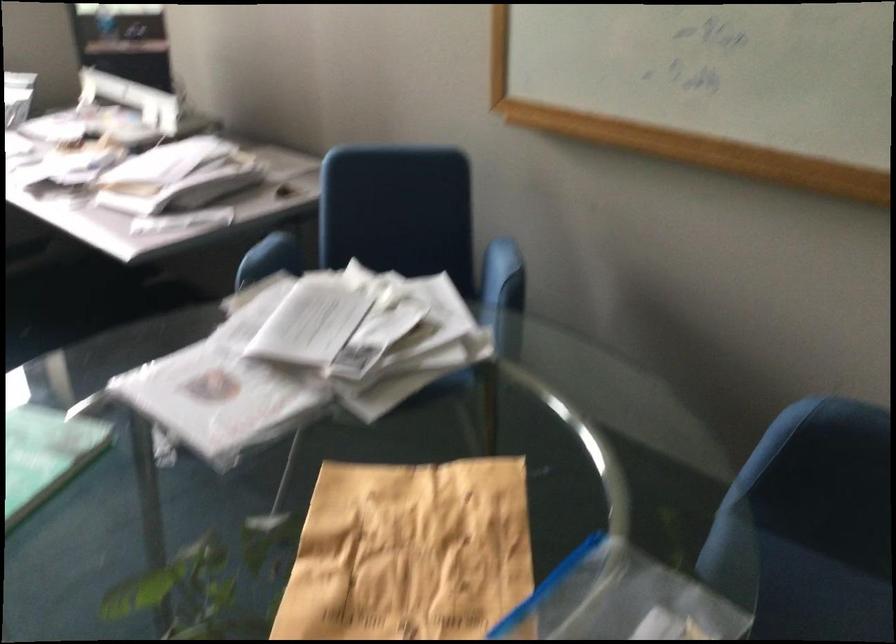
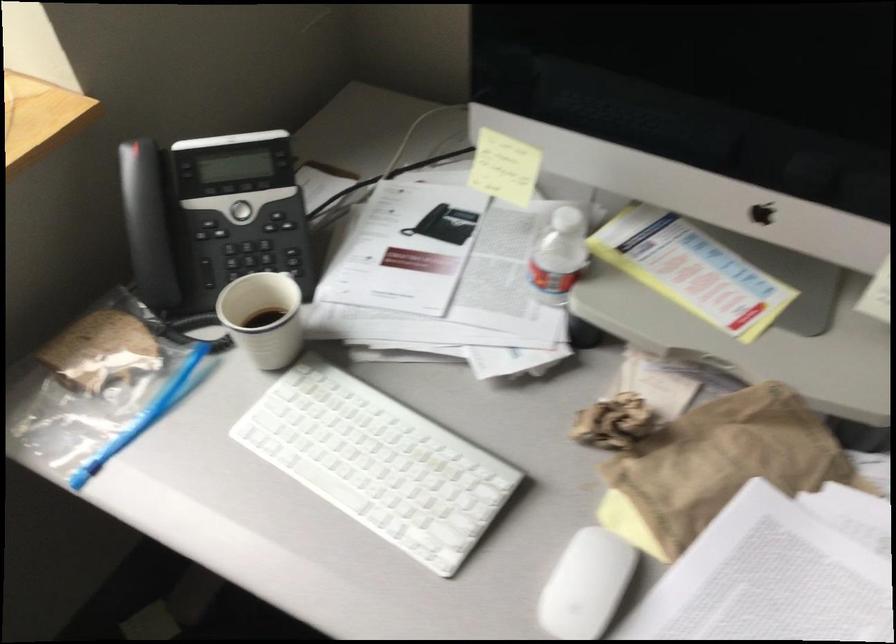
In the second image, find the point that corresponds to [87,79] in the first image.

(558, 254)